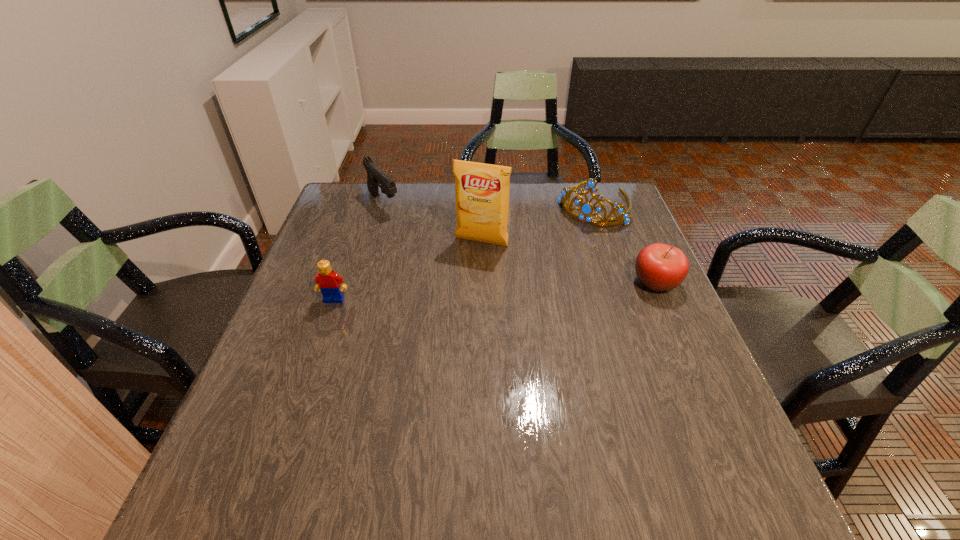
What are the coordinates of `free space in the image that satisfies the following two spatial constraints: 1. on the back side of the third farthest object; 2. on the left side of the tiara` in the screenshot? It's located at (481, 204).

The image size is (960, 540). What are the coordinates of `free space that satisfies the following two spatial constraints: 1. on the back side of the tiara; 2. on the right side of the third nearest object` in the screenshot? It's located at (481, 204).